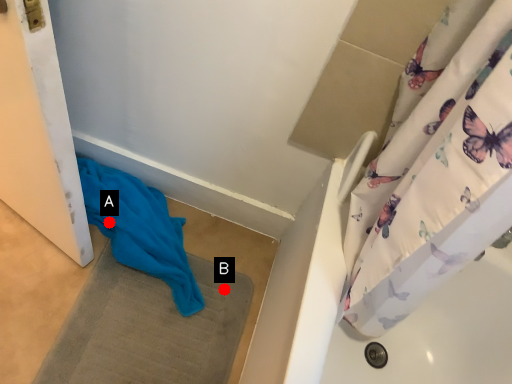
Question: Two points are circled on the image, labeled by A and B beside each circle. Which point appears closest to the camera in this image?

Choices:
 (A) A is closer
 (B) B is closer

Answer: (A)